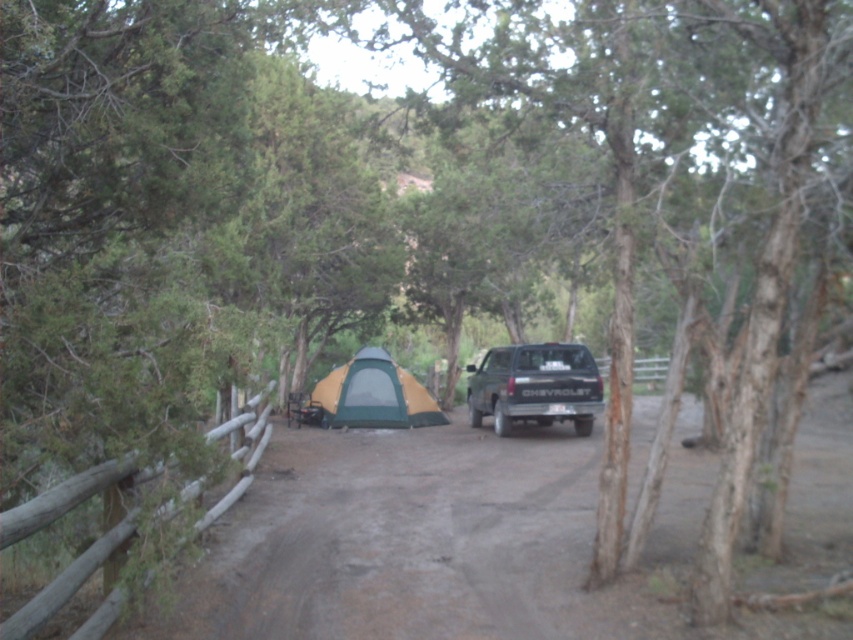
Question: Can you confirm if matte black truck at center is positioned above wooden fence at left?

Choices:
 (A) yes
 (B) no

Answer: (A)

Question: Which point is closer to the camera?

Choices:
 (A) tap(599, 401)
 (B) tap(111, 548)

Answer: (B)

Question: Estimate the real-world distances between objects in this image. Which object is farther from the wooden fence at left?

Choices:
 (A) dirt track at center
 (B) green fabric tent at center

Answer: (B)

Question: Can you confirm if green fabric tent at center is positioned to the left of wooden fence at left?

Choices:
 (A) yes
 (B) no

Answer: (B)

Question: Can you confirm if dirt track at center is positioned to the right of green fabric tent at center?

Choices:
 (A) no
 (B) yes

Answer: (B)

Question: Which point is farther from the camera taking this photo?

Choices:
 (A) (581, 552)
 (B) (376, 376)

Answer: (B)